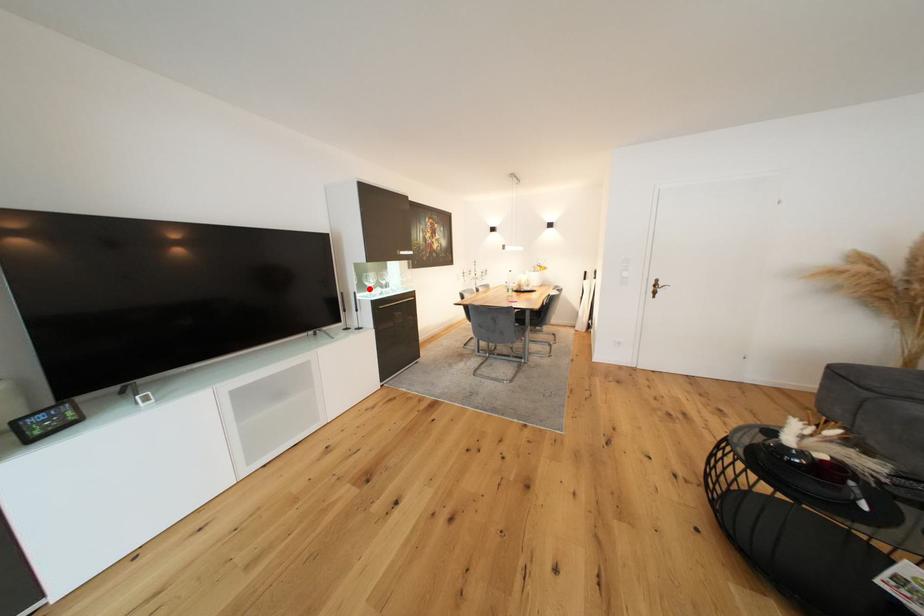
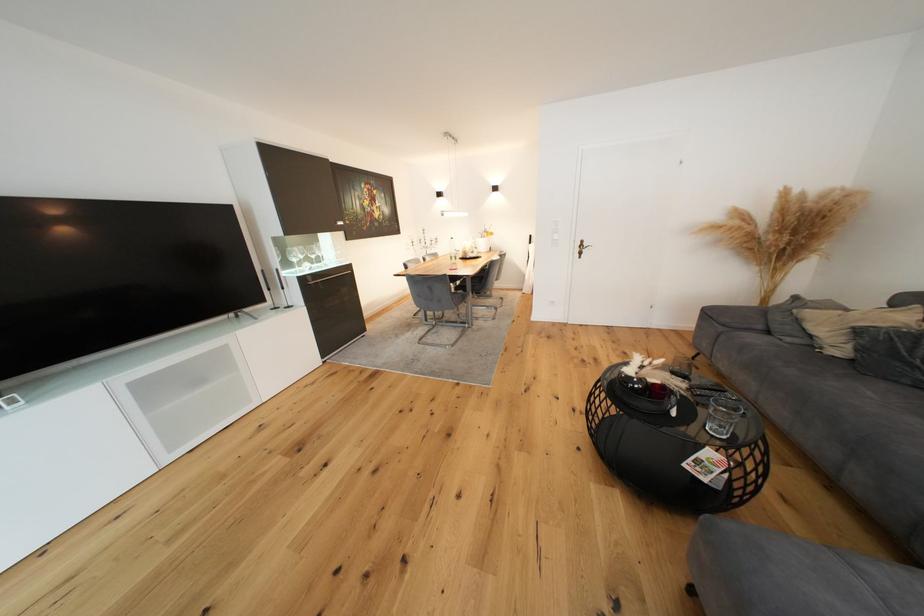
Find the pixel in the second image that matches the highlighted location in the first image.

(295, 265)